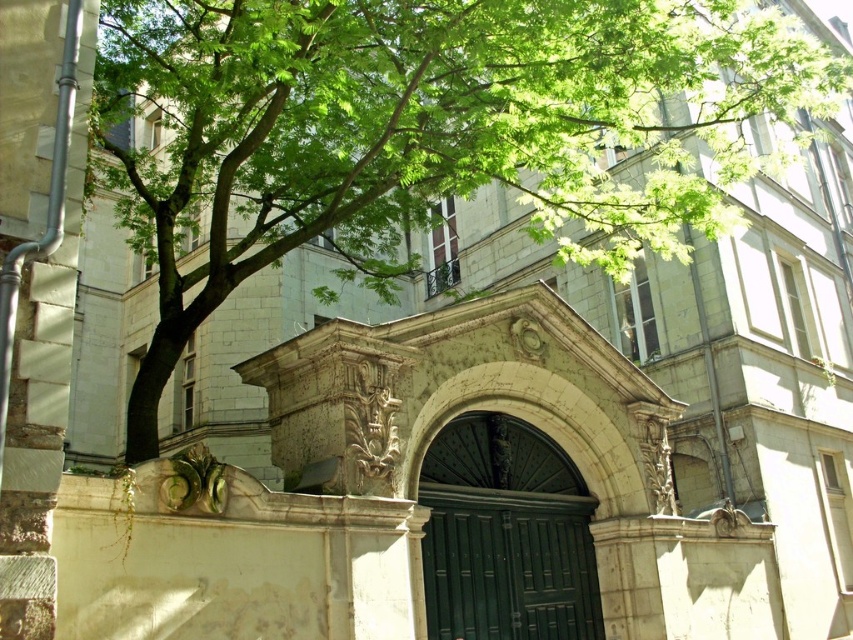
You are standing in front of the historic building and want to touch the green polished wood door at center. However, there is a green leafy tree at center blocking your path. Can you reach the door without moving the tree?

The green leafy tree at center is closer to the viewer than the green polished wood door at center, so you can walk around the tree to reach the door as it is behind the tree.

You are standing in front of the historic building and want to enter through the green polished wood door at center. However, there is a green leafy tree at center above the door. Do you think the tree might block your entrance?

The green leafy tree at center is located above the green polished wood door at center, so it is positioned over the door and should not block your entrance.

You are standing in front of the historic building and want to take a photo of both the dark green arched door and the intricate carvings on the columns. You notice two points marked on the entrance area at coordinates point (x=262, y=237) and point (x=438, y=506). Which point is closer to your camera lens when focusing on the entrance?

Point (x=262, y=237) is further to the camera than point (x=438, y=506). Therefore, when focusing on the entrance, the point (x=262, y=237) will be closer to your camera lens compared to point (x=438, y=506).